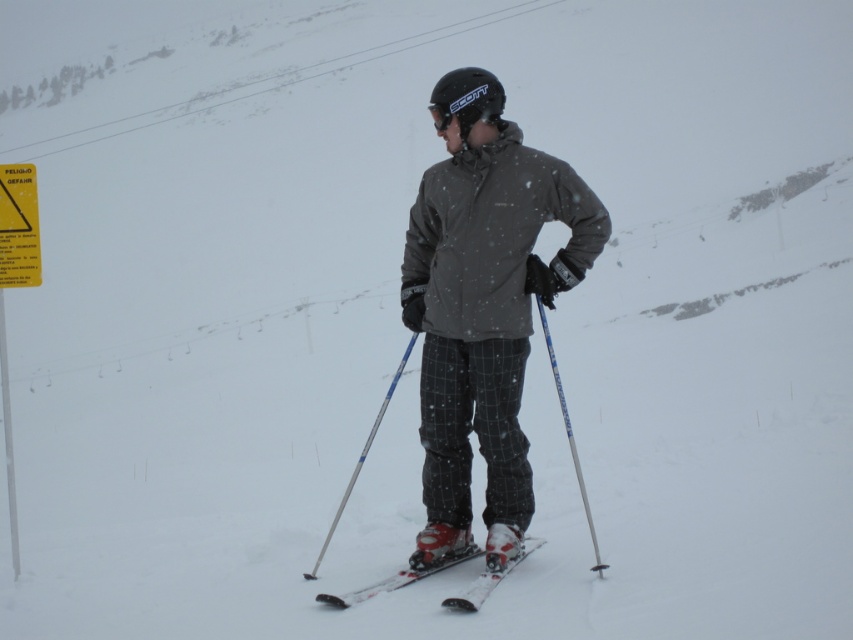
Which is in front, point (358, 592) or point (389, 384)?

Point (358, 592) is in front.

Between white plastic ski at center and silver metallic ski pole at center, which one is positioned lower?

Positioned lower is silver metallic ski pole at center.

Between point (469, 602) and point (373, 433), which one is positioned in front?

Positioned in front is point (469, 602).

At what (x,y) coordinates should I click in order to perform the action: click on white plastic ski at center. Please return your answer as a coordinate pair (x, y). Looking at the image, I should click on (390, 582).

Between yellow paper sign at upper left and silver metallic ski pole at center, which one has more height?

silver metallic ski pole at center is taller.

Between yellow paper sign at upper left and silver metallic ski pole at center, which one appears on the right side from the viewer's perspective?

From the viewer's perspective, silver metallic ski pole at center appears more on the right side.

Does point (36, 262) lie in front of point (345, 490)?

Yes, point (36, 262) is closer to viewer.

Where is `yellow paper sign at upper left`? The height and width of the screenshot is (640, 853). yellow paper sign at upper left is located at coordinates (18, 227).

At what (x,y) coordinates should I click in order to perform the action: click on dark gray matte jacket at center. Please return your answer as a coordinate pair (x, y). Image resolution: width=853 pixels, height=640 pixels. Looking at the image, I should click on tap(483, 307).